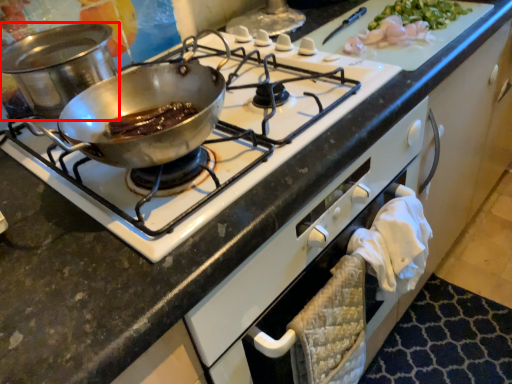
Question: From the image, what is the correct spatial relationship of kitchen appliance (annotated by the red box) in relation to gas stove?

Choices:
 (A) right
 (B) left

Answer: (B)